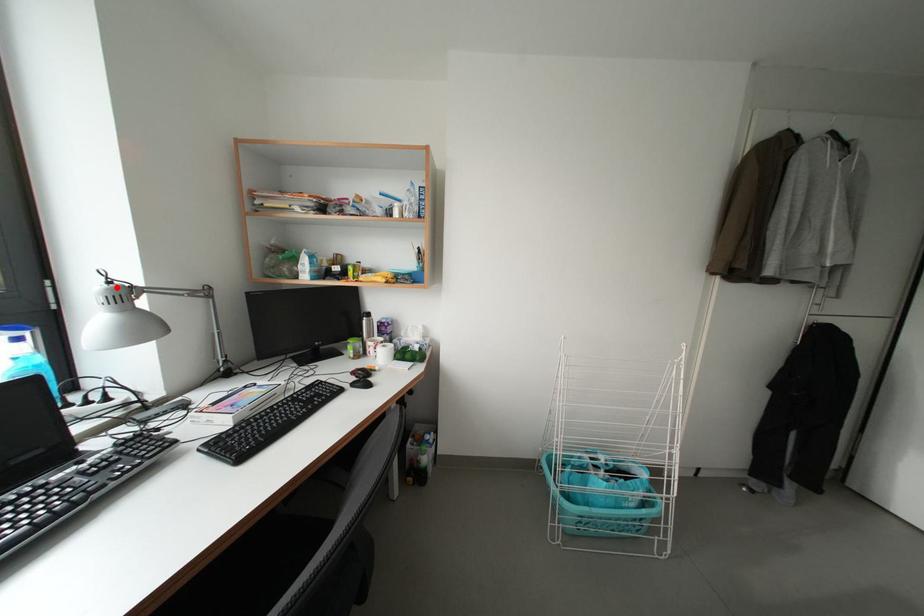
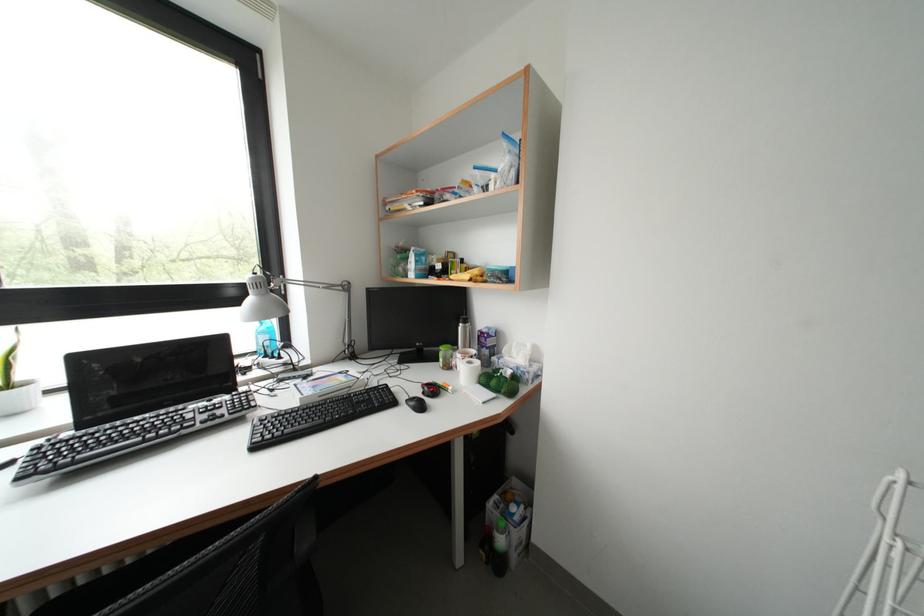
In the second image, find the point that corresponds to the highlighted location in the first image.

(261, 278)